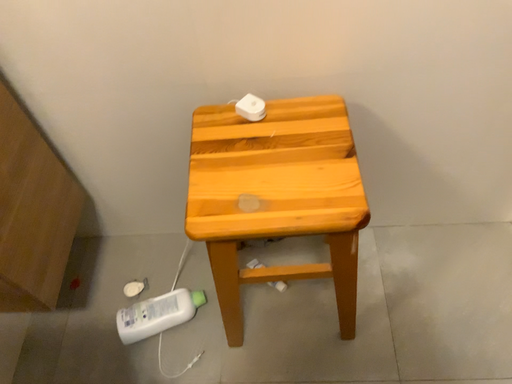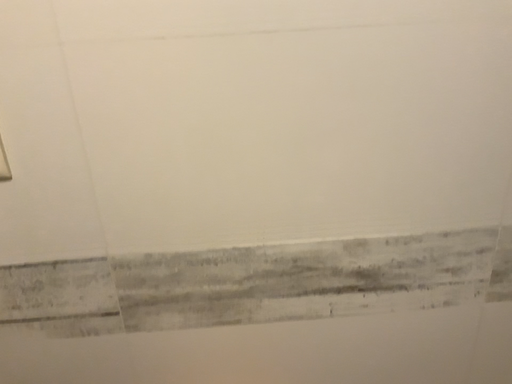
Question: How did the camera likely rotate when shooting the video?

Choices:
 (A) rotated upward
 (B) rotated downward

Answer: (A)